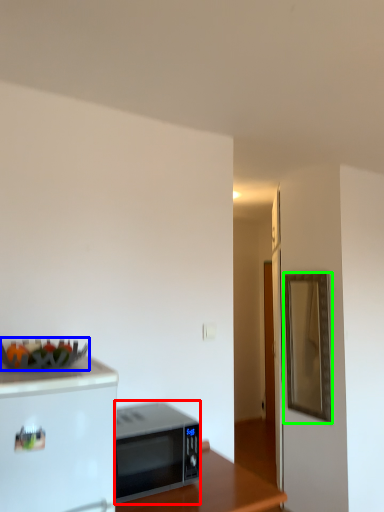
Question: Based on their relative distances, which object is nearer to microwave oven (highlighted by a red box)? Choose from food (highlighted by a blue box) and mirror (highlighted by a green box).

Choices:
 (A) food
 (B) mirror

Answer: (A)